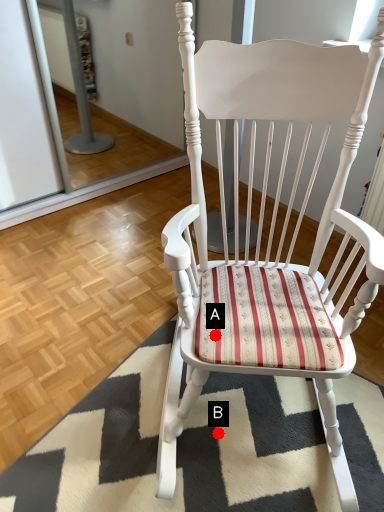
Question: Two points are circled on the image, labeled by A and B beside each circle. Which point is farther to the camera?

Choices:
 (A) A is further
 (B) B is further

Answer: (B)